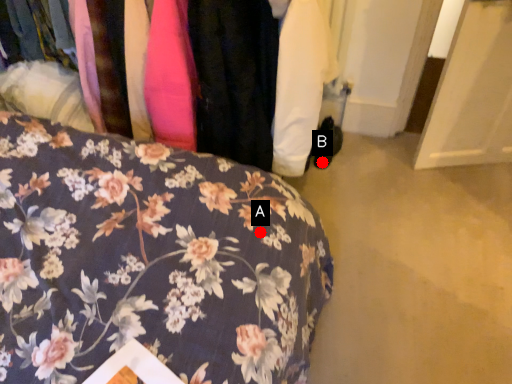
Question: Two points are circled on the image, labeled by A and B beside each circle. Which of the following is the farthest from the observer?

Choices:
 (A) A is further
 (B) B is further

Answer: (B)